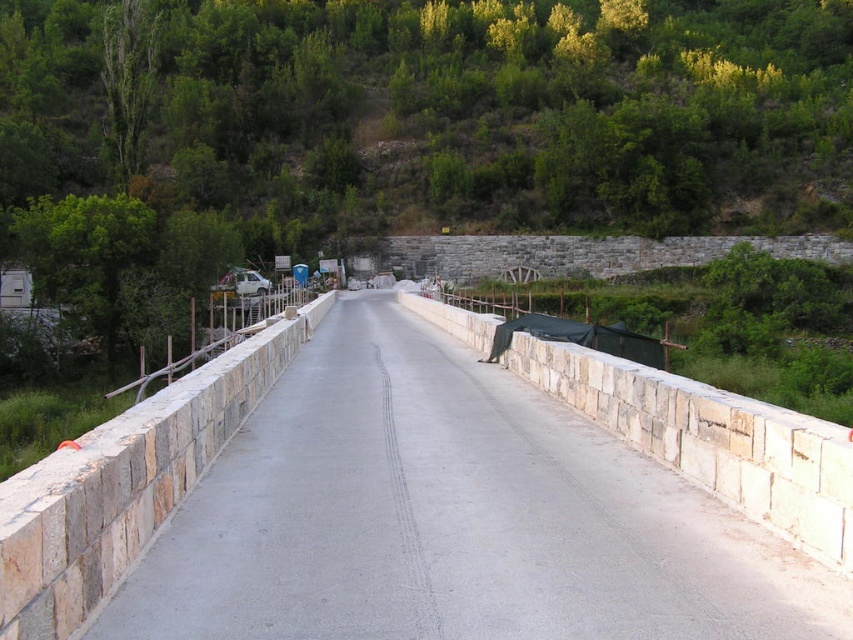
You are a surveyor who needs to mark the exact center of the road. You have a map with coordinates. According to the map, where should you place the marker relative to the green leafy tree at center?

The green leafy tree at center is located at coordinates point (421, 120). To find the road center, you should place the marker directly in line with the tree since the tree is positioned at the center of the road.

You are standing at the point marked by the coordinates point (421,120) on the image. According to the scene description, what object are you currently standing on?

The point (421,120) is on the green leafy tree at center, so you are standing on the green leafy tree at center.